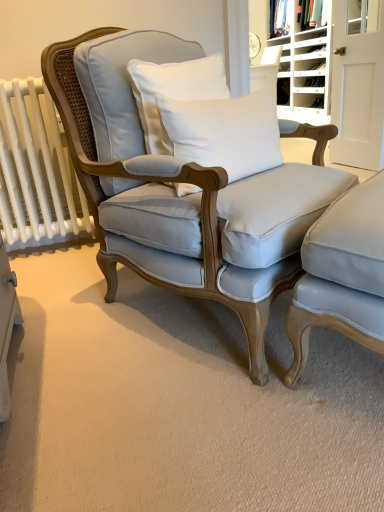
Question: Could white plastic shoe rack at upper right be considered to be inside light blue fabric chair at center, which appears as the first chair when viewed from the left?

Choices:
 (A) no
 (B) yes

Answer: (A)

Question: Is light blue fabric chair at center, the second chair viewed from the right, beside white plastic shoe rack at upper right?

Choices:
 (A) yes
 (B) no

Answer: (B)

Question: From a real-world perspective, is light blue fabric chair at center, which appears as the first chair when viewed from the left, under white plastic shoe rack at upper right?

Choices:
 (A) yes
 (B) no

Answer: (A)

Question: Can you confirm if light blue fabric chair at center, the second chair viewed from the right, is taller than white plastic shoe rack at upper right?

Choices:
 (A) no
 (B) yes

Answer: (A)

Question: Does light blue fabric chair at center, which appears as the first chair when viewed from the left, have a greater width compared to white plastic shoe rack at upper right?

Choices:
 (A) yes
 (B) no

Answer: (A)

Question: In the image, is white wood door at upper right positioned in front of or behind matte white fabric at upper right?

Choices:
 (A) behind
 (B) front

Answer: (B)

Question: Would you say white wood door at upper right is inside or outside matte white fabric at upper right?

Choices:
 (A) inside
 (B) outside

Answer: (B)

Question: Considering the positions of white wood door at upper right and matte white fabric at upper right in the image, is white wood door at upper right wider or thinner than matte white fabric at upper right?

Choices:
 (A) wide
 (B) thin

Answer: (B)

Question: From the image's perspective, relative to matte white fabric at upper right, is white wood door at upper right above or below?

Choices:
 (A) below
 (B) above

Answer: (A)

Question: Is white cotton pillow at center, the second pillow when ordered from bottom to top, taller or shorter than white wood door at upper right?

Choices:
 (A) short
 (B) tall

Answer: (A)

Question: Is white cotton pillow at center, the second pillow when ordered from bottom to top, situated inside white wood door at upper right or outside?

Choices:
 (A) inside
 (B) outside

Answer: (B)

Question: Is point (157, 123) positioned closer to the camera than point (382, 111)?

Choices:
 (A) closer
 (B) farther

Answer: (A)

Question: Looking at their shapes, would you say white cotton pillow at center, the first pillow in the top-to-bottom sequence, is wider or thinner than white wood door at upper right?

Choices:
 (A) thin
 (B) wide

Answer: (B)

Question: From a real-world perspective, is white cotton pillow at center, the second pillow when ordered from bottom to top, positioned above or below light blue fabric chair at center, the second chair viewed from the right?

Choices:
 (A) above
 (B) below

Answer: (A)

Question: Is white cotton pillow at center, the first pillow in the top-to-bottom sequence, in front of or behind light blue fabric chair at center, the second chair viewed from the right, in the image?

Choices:
 (A) behind
 (B) front

Answer: (A)